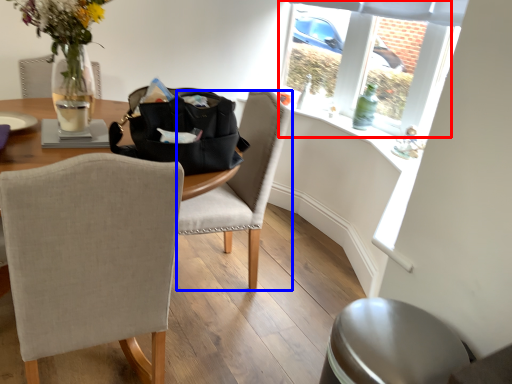
Question: Which of the following is the farthest to the observer, bay window (highlighted by a red box) or chair (highlighted by a blue box)?

Choices:
 (A) bay window
 (B) chair

Answer: (A)